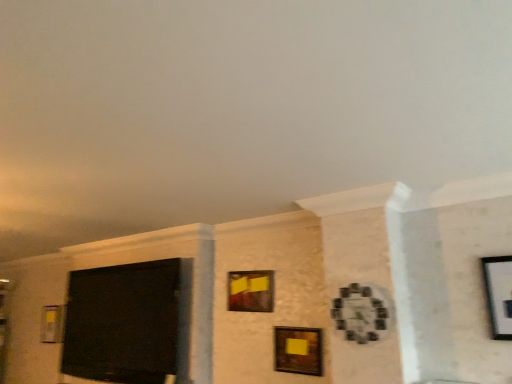
Question: From the image's perspective, is matte wooden picture frame at center, the 2th picture frame viewed from the right, below matte black screen at left?

Choices:
 (A) no
 (B) yes

Answer: (A)

Question: Is matte wooden picture frame at center, the 2th picture frame viewed from the right, in contact with matte black screen at left?

Choices:
 (A) yes
 (B) no

Answer: (B)

Question: Would you say matte wooden picture frame at center, the 2th picture frame viewed from the right, contains matte black screen at left?

Choices:
 (A) no
 (B) yes

Answer: (A)

Question: Does matte wooden picture frame at center, acting as the 3th picture frame starting from the back, have a greater width compared to matte black screen at left?

Choices:
 (A) yes
 (B) no

Answer: (B)

Question: Is matte wooden picture frame at center, which is the second picture frame in front-to-back order, thinner than matte black screen at left?

Choices:
 (A) no
 (B) yes

Answer: (B)

Question: In terms of width, does matte black screen at left look wider or thinner when compared to matte yellow paper at center, acting as the 2th picture frame starting from the back?

Choices:
 (A) wide
 (B) thin

Answer: (A)

Question: Visually, is matte black screen at left positioned to the left or to the right of matte yellow paper at center, which is the third picture frame in right-to-left order?

Choices:
 (A) right
 (B) left

Answer: (B)

Question: Considering the positions of matte black screen at left and matte yellow paper at center, which ranks as the third picture frame in front-to-back order, in the image, is matte black screen at left taller or shorter than matte yellow paper at center, which ranks as the third picture frame in front-to-back order,?

Choices:
 (A) tall
 (B) short

Answer: (A)

Question: Based on their sizes in the image, would you say matte black screen at left is bigger or smaller than matte yellow paper at center, the 2th picture frame positioned from the left?

Choices:
 (A) big
 (B) small

Answer: (A)

Question: From a real-world perspective, is matte black screen at left above or below wooden clock at center-right, the first picture frame viewed from the right?

Choices:
 (A) above
 (B) below

Answer: (B)

Question: In the image, is matte black screen at left positioned in front of or behind wooden clock at center-right, arranged as the 4th picture frame when viewed from the back?

Choices:
 (A) behind
 (B) front

Answer: (A)

Question: From their relative heights in the image, would you say matte black screen at left is taller or shorter than wooden clock at center-right, which appears as the first picture frame when viewed from the front?

Choices:
 (A) short
 (B) tall

Answer: (B)

Question: Considering the positions of point (170, 347) and point (372, 299), is point (170, 347) closer or farther from the camera than point (372, 299)?

Choices:
 (A) farther
 (B) closer

Answer: (A)

Question: Is matte yellow paper at center, acting as the 2th picture frame starting from the back, inside or outside of matte wooden picture frame at center, the 2th picture frame viewed from the right?

Choices:
 (A) outside
 (B) inside

Answer: (A)

Question: From the image's perspective, is matte yellow paper at center, the 2th picture frame positioned from the left, above or below matte wooden picture frame at center, which appears as the third picture frame when viewed from the left?

Choices:
 (A) below
 (B) above

Answer: (B)